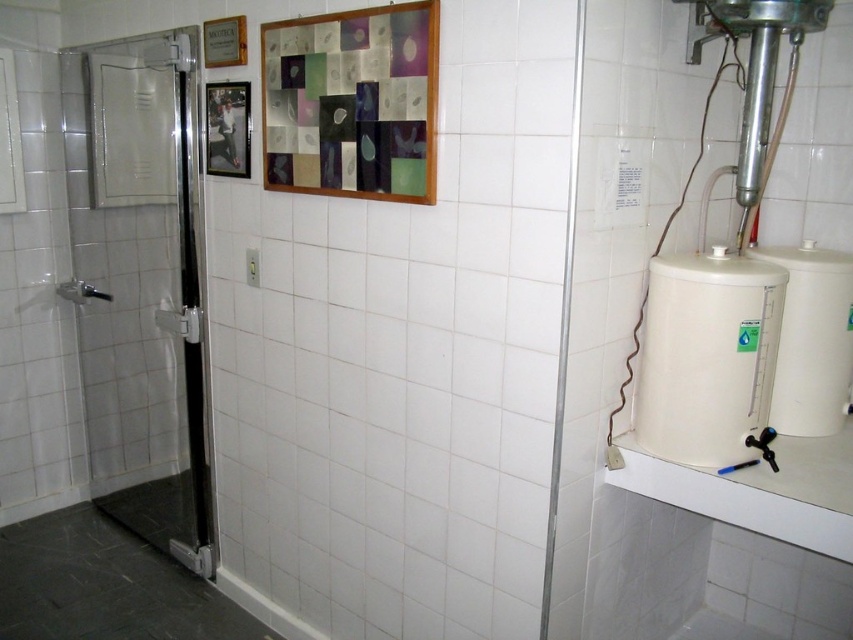
Is white matte water tank at right positioned before metallic silver picture frame at upper left?

Yes, it is in front of metallic silver picture frame at upper left.

From the picture: Is white matte water tank at right positioned at the back of metallic silver picture frame at upper left?

No, it is in front of metallic silver picture frame at upper left.

Is point (763, 387) closer to viewer compared to point (248, 150)?

Yes, it is in front of point (248, 150).

The width and height of the screenshot is (853, 640). I want to click on white matte water tank at right, so click(709, 358).

Is transparent glass door at left wider than metallic silver picture frame at upper left?

Correct, the width of transparent glass door at left exceeds that of metallic silver picture frame at upper left.

In the scene shown: Is transparent glass door at left smaller than metallic silver picture frame at upper left?

No, transparent glass door at left is not smaller than metallic silver picture frame at upper left.

Does point (167, 369) come closer to viewer compared to point (227, 172)?

No, (167, 369) is further to viewer.

This screenshot has width=853, height=640. I want to click on transparent glass door at left, so (141, 282).

Is transparent glass door at left bigger than white matte water tank at right?

Correct, transparent glass door at left is larger in size than white matte water tank at right.

Identify the location of transparent glass door at left. (141, 282).